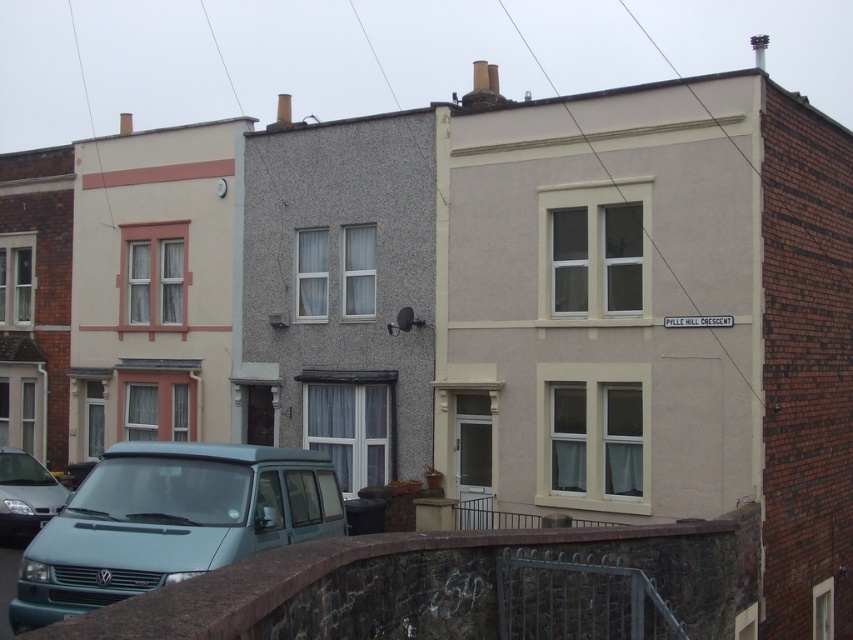
You are a delivery driver who needs to park your teal matte van at center and matte silver van at lower left in a parking spot that can only accommodate vehicles up to 2 meters in height. Which van should you park first to ensure both can fit?

The teal matte van at center is much taller than the matte silver van at lower left. Since the parking spot can only accommodate vehicles up to 2 meters in height, you should park the matte silver van at lower left first, then the teal matte van at center might not fit if it exceeds the height limit. However, if the teal matte van is under 2 meters, both can fit. Check the exact height of the teal matte van before deciding.

You are a delivery driver who needs to park your teal matte van at center and matte silver van at lower left in a parking spot that is 2 meters wide. Which van should you park first to ensure both can fit?

The teal matte van at center is wider than the matte silver van at lower left. You should park the matte silver van at lower left first, then the teal matte van at center, as the wider van requires more space and should be positioned last to accommodate its size within the 2 meter parking spot.

You are standing at the intersection near the houses on Pylle Hill Crescent. You see a teal matte van at center. Can you estimate its position relative to the central house?

The teal matte van at center is located at coordinates 0.816 on the x axis and 0.200 on the y axis, which places it near the center of the image, aligned with the central house.